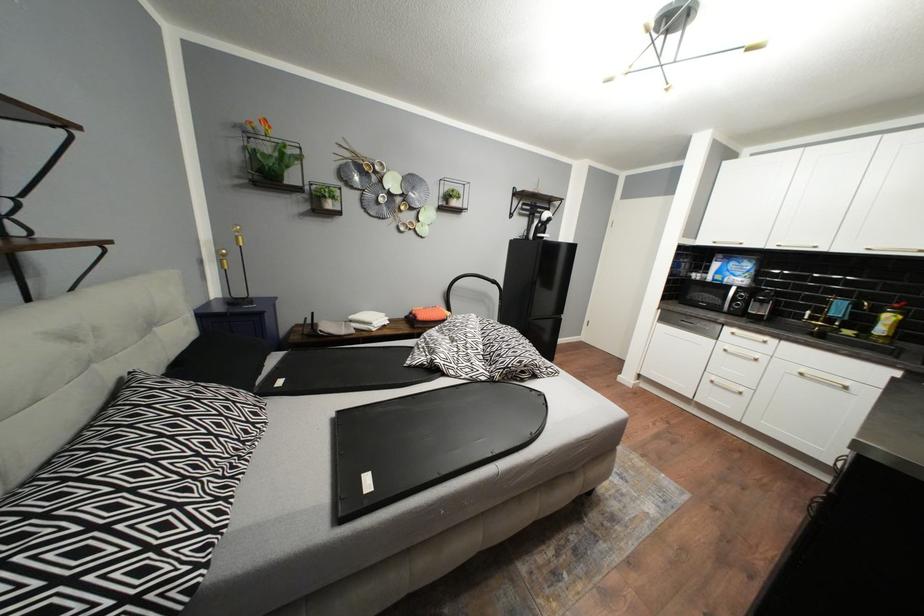
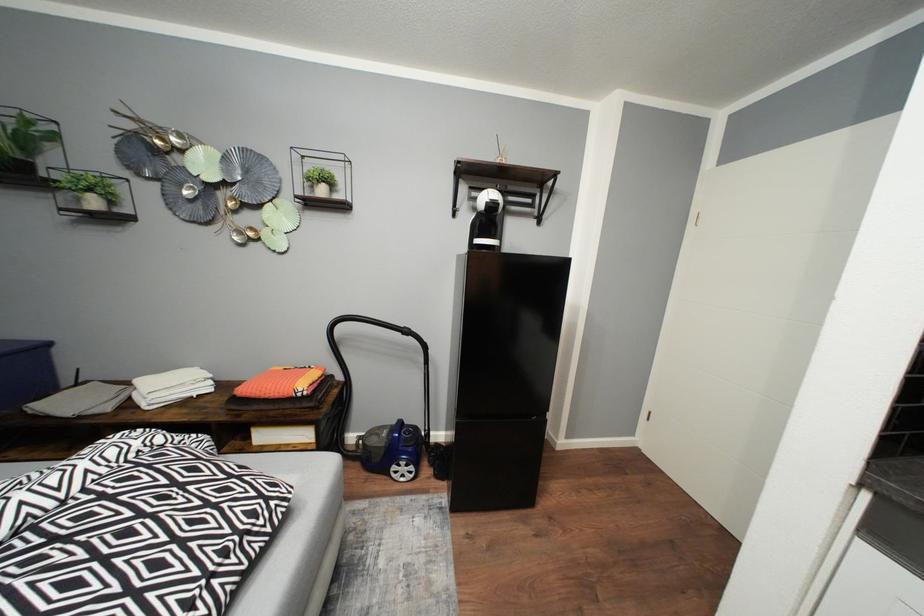
The images are taken continuously from a first-person perspective. In which direction are you moving?

The movement direction of the cameraman is right, forward.